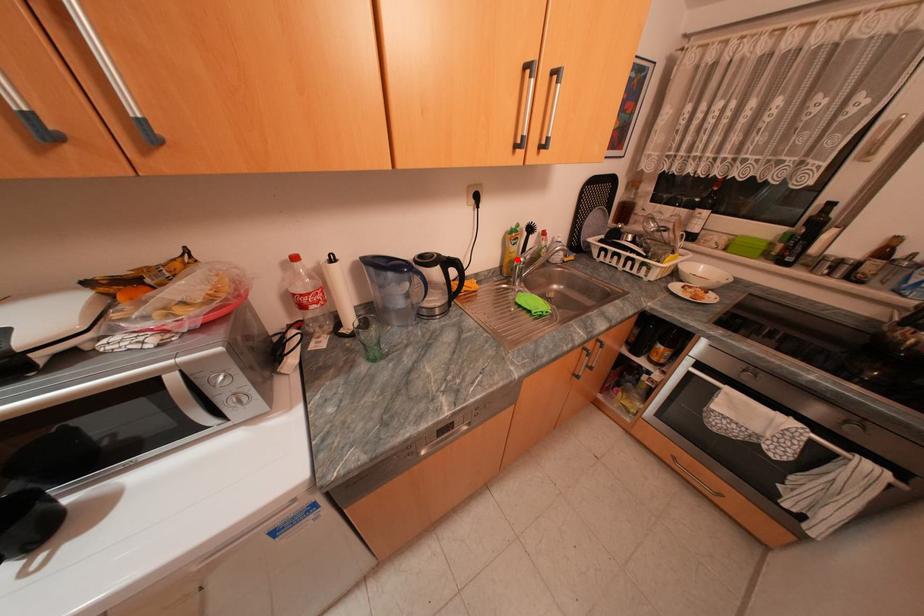
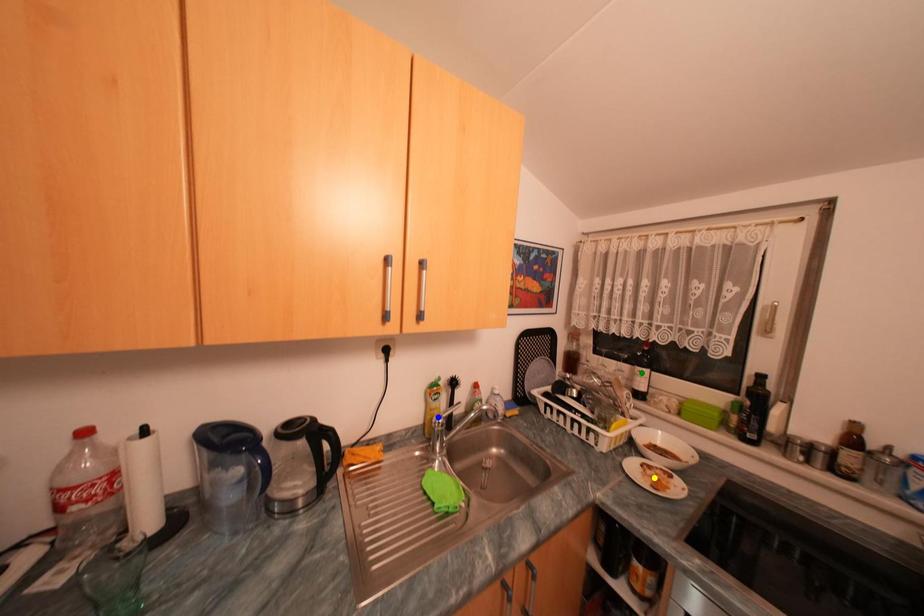
Question: I am providing you with two images of the same scene from different viewpoints. A red point is marked on the first image. You are given multiple points on the second image. In image 2, which mark is for the same physical point as the one in image 1?

Choices:
 (A) blue point
 (B) green point
 (C) yellow point

Answer: (A)